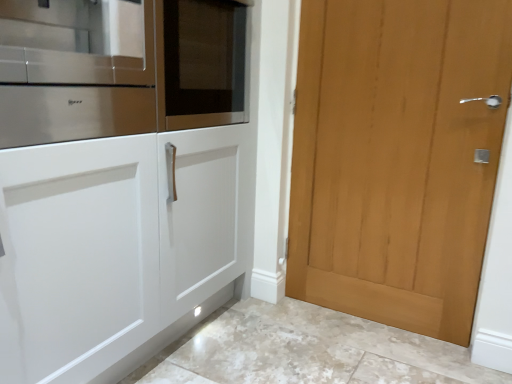
Question: Is light brown wood door at right taller than white marble floor at lower center?

Choices:
 (A) no
 (B) yes

Answer: (B)

Question: Is light brown wood door at right in front of white marble floor at lower center?

Choices:
 (A) yes
 (B) no

Answer: (B)

Question: Is light brown wood door at right to the left of white marble floor at lower center from the viewer's perspective?

Choices:
 (A) yes
 (B) no

Answer: (B)

Question: Would you consider light brown wood door at right to be distant from white marble floor at lower center?

Choices:
 (A) yes
 (B) no

Answer: (B)

Question: Could you tell me if light brown wood door at right is turned towards white marble floor at lower center?

Choices:
 (A) yes
 (B) no

Answer: (A)

Question: In terms of width, does stainless steel oven at left look wider or thinner when compared to light brown wood door at right?

Choices:
 (A) wide
 (B) thin

Answer: (A)

Question: From a real-world perspective, is stainless steel oven at left physically located above or below light brown wood door at right?

Choices:
 (A) below
 (B) above

Answer: (B)

Question: In the image, is stainless steel oven at left on the left side or the right side of light brown wood door at right?

Choices:
 (A) right
 (B) left

Answer: (B)

Question: Is stainless steel oven at left taller or shorter than light brown wood door at right?

Choices:
 (A) short
 (B) tall

Answer: (A)

Question: Is light brown wood door at right situated inside white marble floor at lower center or outside?

Choices:
 (A) outside
 (B) inside

Answer: (A)

Question: From the image's perspective, is light brown wood door at right located above or below white marble floor at lower center?

Choices:
 (A) below
 (B) above

Answer: (B)

Question: From a real-world perspective, is light brown wood door at right positioned above or below white marble floor at lower center?

Choices:
 (A) above
 (B) below

Answer: (A)

Question: In terms of size, does light brown wood door at right appear bigger or smaller than white marble floor at lower center?

Choices:
 (A) small
 (B) big

Answer: (A)

Question: From their relative heights in the image, would you say light brown wood door at right is taller or shorter than stainless steel oven at left?

Choices:
 (A) tall
 (B) short

Answer: (A)

Question: Visually, is light brown wood door at right positioned to the left or to the right of stainless steel oven at left?

Choices:
 (A) left
 (B) right

Answer: (B)